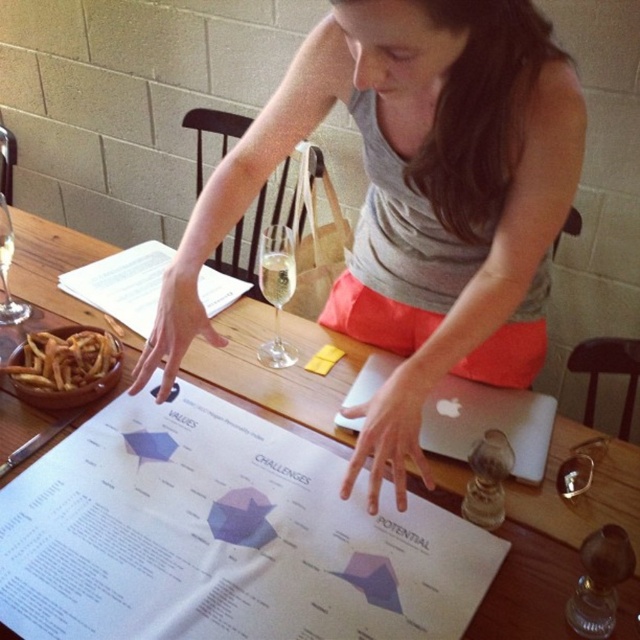
Question: Is clear glass wine glass at center thinner than clear glass wine at table left?

Choices:
 (A) yes
 (B) no

Answer: (B)

Question: Which of these objects is positioned closest to the golden crispy fries at lower left?

Choices:
 (A) white paper document at center
 (B) clear glass wine at center
 (C) white wood table at center
 (D) clear glass wine glass at center

Answer: (C)

Question: Which of the following is the closest to the observer?

Choices:
 (A) (16, 387)
 (B) (435, 157)
 (C) (6, 257)
 (D) (269, 362)

Answer: (B)

Question: Can you confirm if white paper document at center is positioned below clear glass wine at center?

Choices:
 (A) yes
 (B) no

Answer: (A)

Question: Among these objects, which one is farthest from the camera?

Choices:
 (A) white wood table at center
 (B) clear glass wine at table left
 (C) clear glass wine glass at left
 (D) golden crispy fries at lower left

Answer: (B)

Question: Is white paper document at center closer to camera compared to clear glass wine at table left?

Choices:
 (A) yes
 (B) no

Answer: (A)